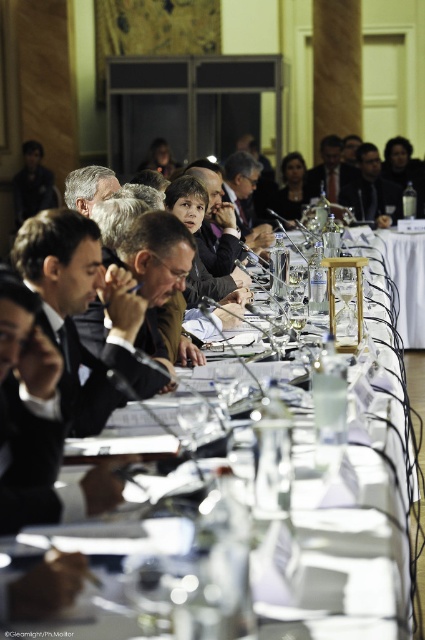
You are a photographer setting up for a group photo at the meeting table. You need to position a backdrop behind the two central figures wearing the black suit at center and the dark brown leather jacket at center. Which figure should you place closer to the backdrop to ensure their jacket is fully visible?

The dark brown leather jacket at center should be placed closer to the backdrop because the black suit at center is positioned under it, meaning the jacket is in front and needs to be nearer to the backdrop to avoid being obscured.